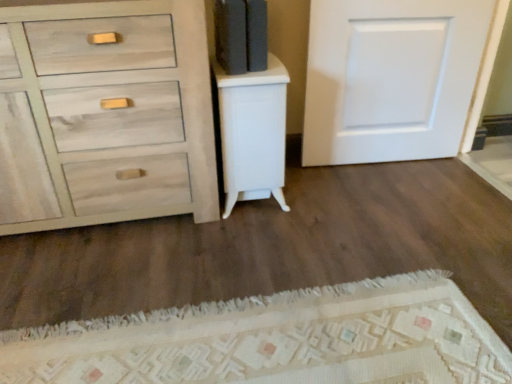
Question: Could you tell me if white matte door at upper right is facing white glossy cabinet at center?

Choices:
 (A) yes
 (B) no

Answer: (B)

Question: Is white matte door at upper right to the left of white glossy cabinet at center from the viewer's perspective?

Choices:
 (A) no
 (B) yes

Answer: (A)

Question: Can you confirm if white matte door at upper right is smaller than white glossy cabinet at center?

Choices:
 (A) yes
 (B) no

Answer: (A)

Question: Is the position of white matte door at upper right less distant than that of white glossy cabinet at center?

Choices:
 (A) no
 (B) yes

Answer: (A)

Question: Is white glossy cabinet at center a part of white matte door at upper right?

Choices:
 (A) yes
 (B) no

Answer: (B)

Question: In terms of height, does white glossy cabinet at center look taller or shorter compared to white matte door at upper right?

Choices:
 (A) tall
 (B) short

Answer: (B)

Question: Is white glossy cabinet at center wider or thinner than white matte door at upper right?

Choices:
 (A) wide
 (B) thin

Answer: (A)

Question: From the image's perspective, relative to white matte door at upper right, is white glossy cabinet at center above or below?

Choices:
 (A) below
 (B) above

Answer: (A)

Question: Looking at the image, does white glossy cabinet at center seem bigger or smaller compared to white matte door at upper right?

Choices:
 (A) big
 (B) small

Answer: (A)

Question: From a real-world perspective, relative to white glossy cabinet at center, is white matte door at upper right vertically above or below?

Choices:
 (A) below
 (B) above

Answer: (B)

Question: Relative to white glossy cabinet at center, is white matte door at upper right in front or behind?

Choices:
 (A) front
 (B) behind

Answer: (B)

Question: From the image's perspective, is white matte door at upper right positioned above or below white glossy cabinet at center?

Choices:
 (A) above
 (B) below

Answer: (A)

Question: Would you say white matte door at upper right is inside or outside white glossy cabinet at center?

Choices:
 (A) outside
 (B) inside

Answer: (A)

Question: From the image's perspective, is white matte door at upper right positioned above or below light gray wood dresser at left?

Choices:
 (A) above
 (B) below

Answer: (A)

Question: Looking at their shapes, would you say white matte door at upper right is wider or thinner than light gray wood dresser at left?

Choices:
 (A) thin
 (B) wide

Answer: (A)